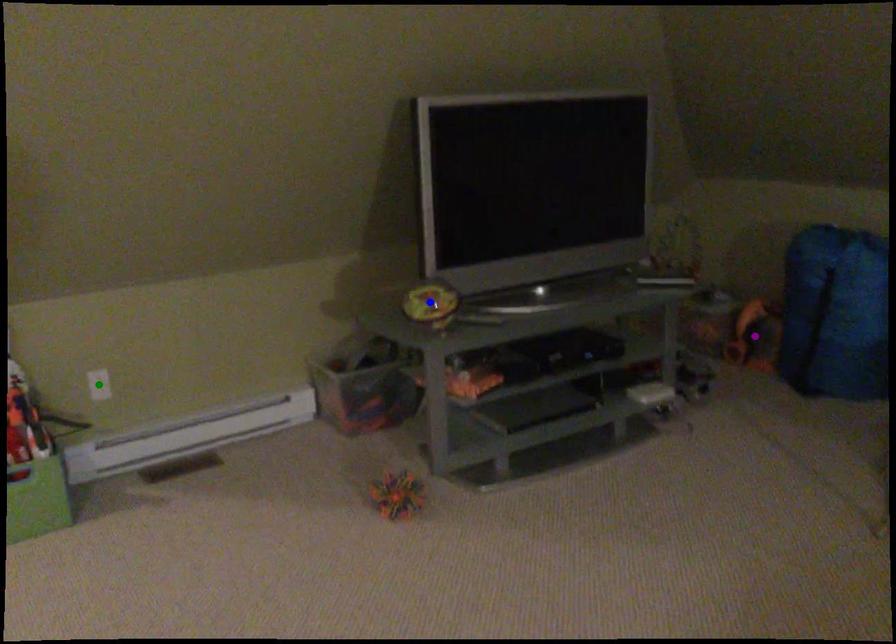
Order these from nearest to farthest:
1. blue point
2. green point
3. purple point

1. purple point
2. green point
3. blue point